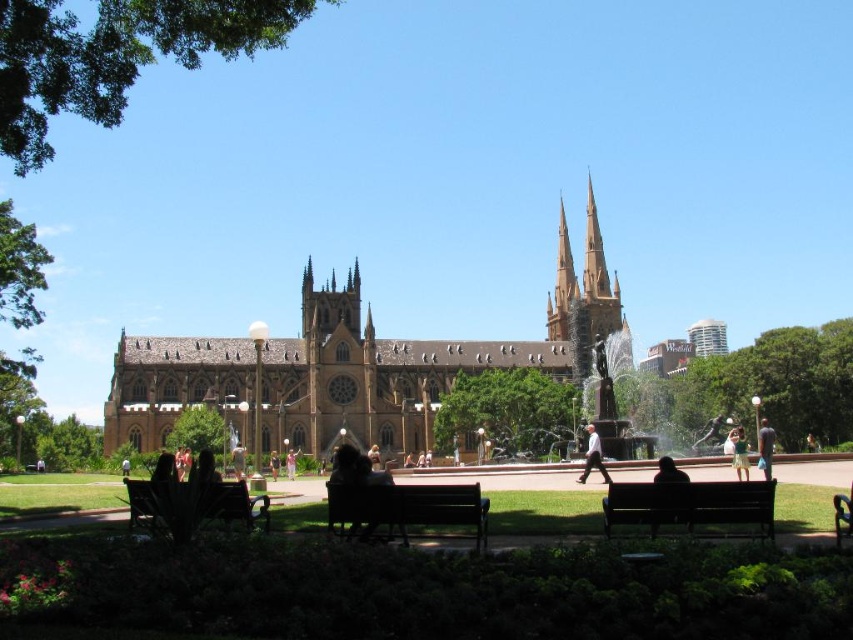
Can you confirm if green fabric dress at center is taller than light brown hair at center?

Yes.

Is point (746, 458) closer to viewer compared to point (126, 477)?

No, it is behind (126, 477).

The height and width of the screenshot is (640, 853). Identify the location of green fabric dress at center. (740, 452).

From the picture: Is brown stone church at center thinner than pink fabric dress at center?

No.

Consider the image. Between brown stone church at center and pink fabric dress at center, which one appears on the left side from the viewer's perspective?

From the viewer's perspective, pink fabric dress at center appears more on the left side.

The width and height of the screenshot is (853, 640). Identify the location of brown stone church at center. (347, 365).

Which is behind, point (675, 477) or point (292, 460)?

Positioned behind is point (292, 460).

Which is behind, point (664, 476) or point (294, 461)?

Point (294, 461)

Where is `dark brown hair at lower center`? The height and width of the screenshot is (640, 853). dark brown hair at lower center is located at coordinates (669, 472).